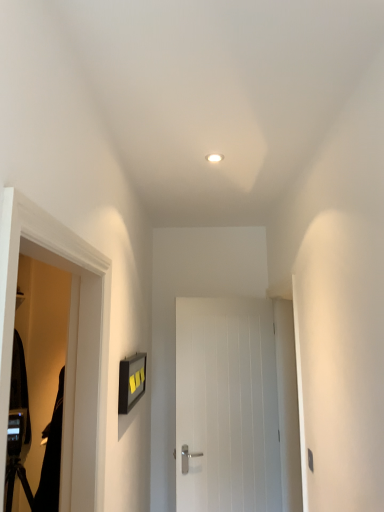
Question: Is white matte light fixture at upper center surrounding black matte robe at left?

Choices:
 (A) yes
 (B) no

Answer: (B)

Question: Does white matte light fixture at upper center have a lesser height compared to black matte robe at left?

Choices:
 (A) no
 (B) yes

Answer: (B)

Question: From the image's perspective, is white matte light fixture at upper center under black matte robe at left?

Choices:
 (A) yes
 (B) no

Answer: (B)

Question: From the image's perspective, is white matte light fixture at upper center on black matte robe at left?

Choices:
 (A) yes
 (B) no

Answer: (A)

Question: Does white matte light fixture at upper center have a larger size compared to black matte robe at left?

Choices:
 (A) no
 (B) yes

Answer: (A)

Question: Is white matte light fixture at upper center in front of black matte robe at left?

Choices:
 (A) no
 (B) yes

Answer: (A)

Question: Considering the relative sizes of black matte screen door at left and white wooden door at center in the image provided, is black matte screen door at left smaller than white wooden door at center?

Choices:
 (A) no
 (B) yes

Answer: (B)

Question: Is black matte screen door at left bigger than white wooden door at center?

Choices:
 (A) no
 (B) yes

Answer: (A)

Question: Is black matte screen door at left taller than white wooden door at center?

Choices:
 (A) yes
 (B) no

Answer: (B)

Question: Is black matte screen door at left oriented away from white wooden door at center?

Choices:
 (A) yes
 (B) no

Answer: (B)

Question: Is black matte screen door at left oriented towards white wooden door at center?

Choices:
 (A) yes
 (B) no

Answer: (B)

Question: Does black matte screen door at left have a lesser height compared to white wooden door at center?

Choices:
 (A) yes
 (B) no

Answer: (A)

Question: Does white wooden door at center have a lesser width compared to black matte screen door at left?

Choices:
 (A) yes
 (B) no

Answer: (A)